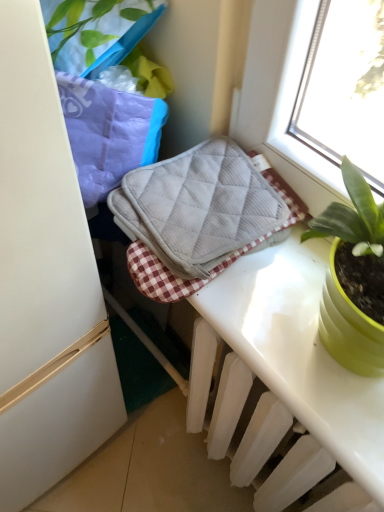
Question: From a real-world perspective, is gray quilted oven mitt at center positioned above or below white plastic radiator at lower center?

Choices:
 (A) above
 (B) below

Answer: (A)

Question: In the image, is gray quilted oven mitt at center positioned in front of or behind white plastic radiator at lower center?

Choices:
 (A) behind
 (B) front

Answer: (A)

Question: Considering the positions of gray quilted oven mitt at center and white plastic radiator at lower center in the image, is gray quilted oven mitt at center wider or thinner than white plastic radiator at lower center?

Choices:
 (A) thin
 (B) wide

Answer: (B)

Question: Which is correct: white plastic radiator at lower center is inside gray quilted oven mitt at center, or outside of it?

Choices:
 (A) inside
 (B) outside

Answer: (B)

Question: Considering their positions, is white plastic radiator at lower center located in front of or behind gray quilted oven mitt at center?

Choices:
 (A) front
 (B) behind

Answer: (A)

Question: Is point tap(238, 394) closer or farther from the camera than point tap(288, 215)?

Choices:
 (A) closer
 (B) farther

Answer: (B)

Question: From the image's perspective, is white plastic radiator at lower center positioned above or below gray quilted oven mitt at center?

Choices:
 (A) below
 (B) above

Answer: (A)